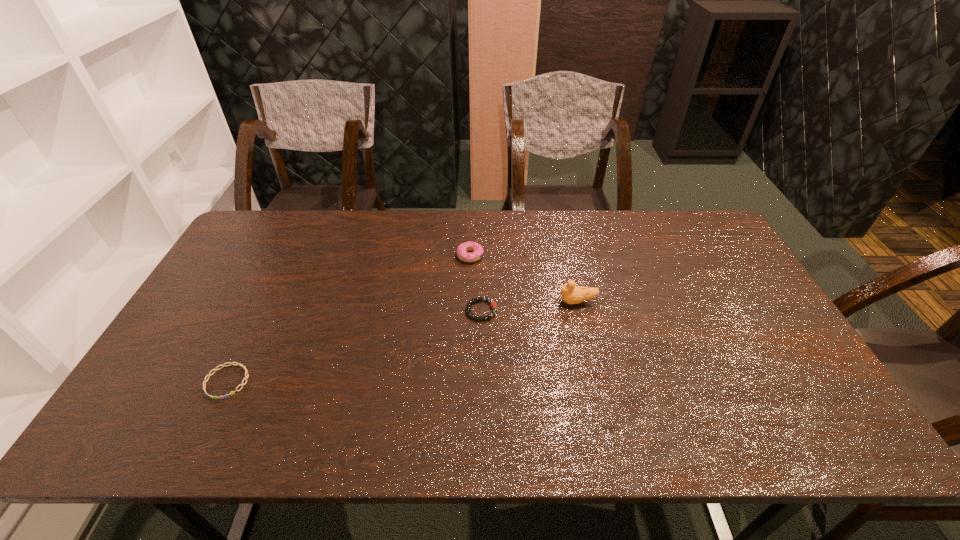
Identify the location of duckling. (571, 294).

In order to click on the tallest object in this screenshot , I will do `click(571, 294)`.

The width and height of the screenshot is (960, 540). Find the location of `the second tallest object`. the second tallest object is located at coordinates (462, 250).

What are the coordinates of `doughnut` in the screenshot? It's located at (462, 250).

The height and width of the screenshot is (540, 960). What are the coordinates of `the right bracelet` in the screenshot? It's located at (493, 304).

At what (x,y) coordinates should I click in order to perform the action: click on the nearer bracelet. Please return your answer as a coordinate pair (x, y). Looking at the image, I should click on (237, 364).

Identify the location of the left bracelet. (237, 364).

You are a GUI agent. You are given a task and a screenshot of the screen. Output one action in this format:
    pyautogui.click(x=<x>, y=<y>)
    Task: Click on the free space located on the face of the rightmost object
    This screenshot has width=960, height=540.
    Given the screenshot: What is the action you would take?
    pyautogui.click(x=446, y=302)

Where is `free region located on the face of the rightmost object`? free region located on the face of the rightmost object is located at coordinates (535, 302).

Where is `vacant region located 0.120m on the face of the rightmost object`? The height and width of the screenshot is (540, 960). vacant region located 0.120m on the face of the rightmost object is located at coordinates [x=517, y=302].